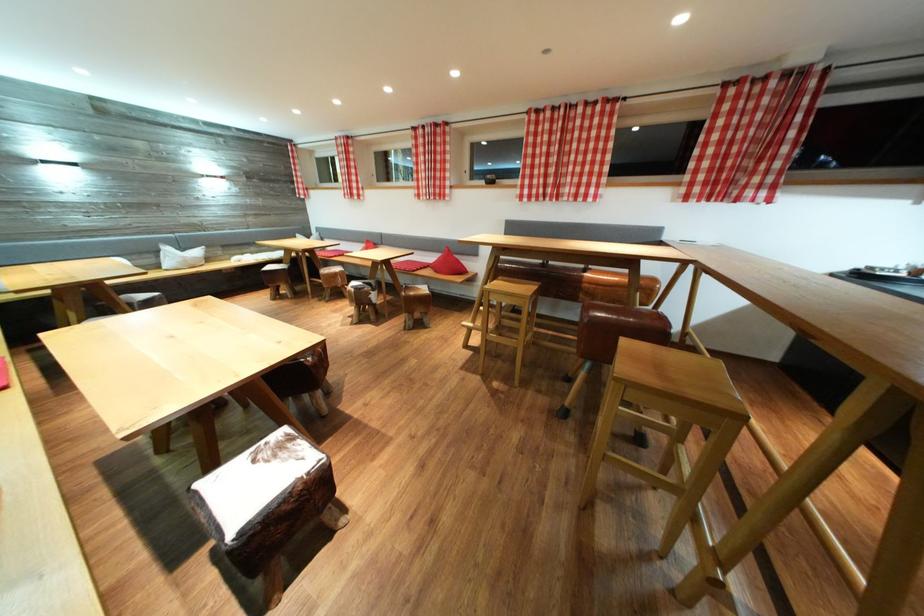
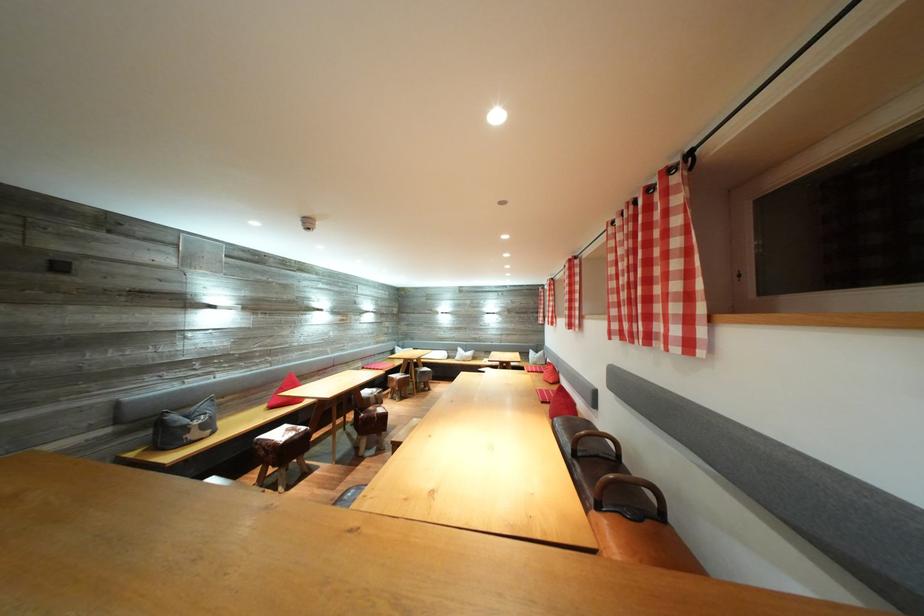
In the second image, find the point that corresponds to (532,197) in the first image.

(622, 331)